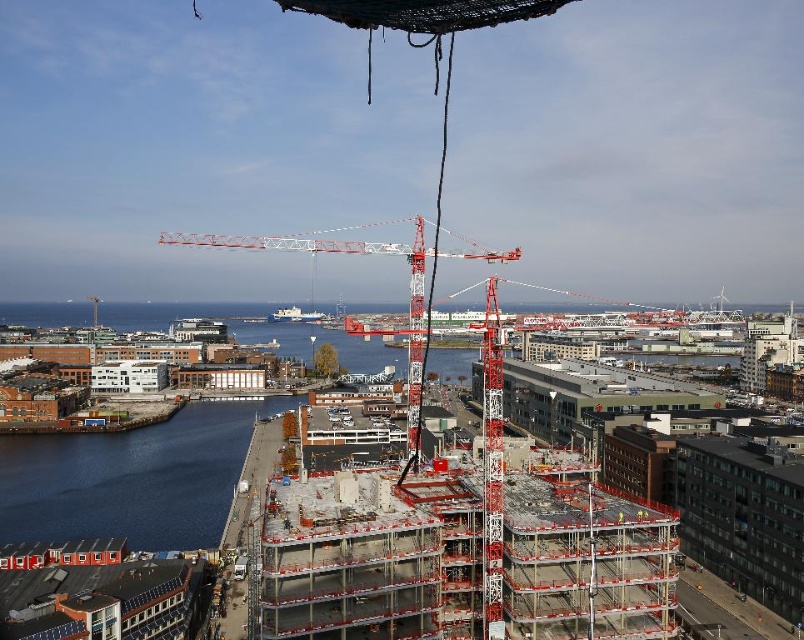
Question: Which of the following is the farthest from the observer?

Choices:
 (A) (218, 506)
 (B) (224, 243)
 (C) (277, 397)

Answer: (B)

Question: Among these points, which one is nearest to the camera?

Choices:
 (A) (413, 305)
 (B) (187, 524)
 (C) (148, 476)

Answer: (A)

Question: Does concrete building at center come in front of blue water at lower left?

Choices:
 (A) no
 (B) yes

Answer: (B)

Question: Is concrete building at center in front of blue water at lower left?

Choices:
 (A) yes
 (B) no

Answer: (A)

Question: Does concrete building at center appear over red metal crane at center?

Choices:
 (A) yes
 (B) no

Answer: (B)

Question: Which of the following is the farthest from the observer?

Choices:
 (A) (413, 285)
 (B) (35, 484)

Answer: (B)